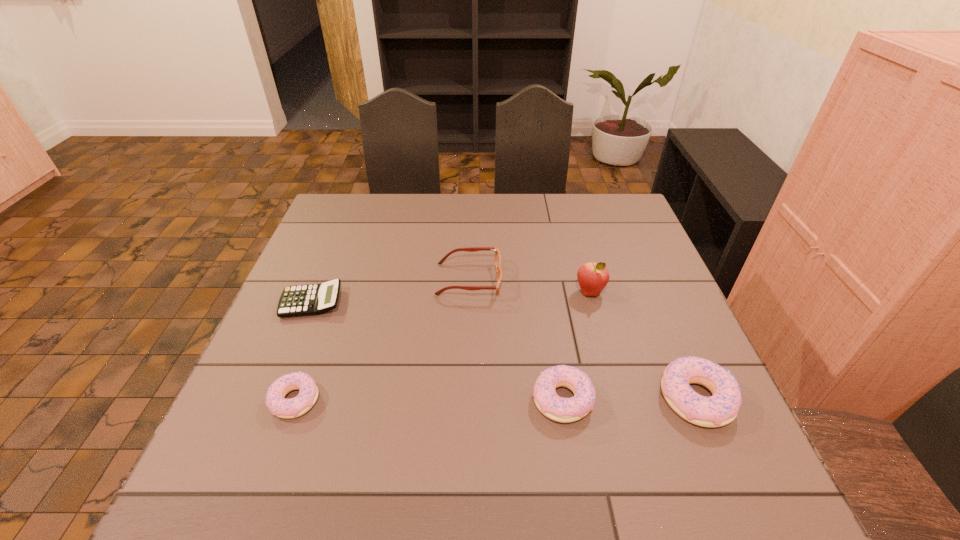
Identify the location of free spot that satisfies the following two spatial constraints: 1. on the back side of the leftmost doughnut; 2. on the left side of the tallest object. The height and width of the screenshot is (540, 960). (334, 292).

Find the location of `vacant space that satisfies the following two spatial constraints: 1. on the back side of the tallest object; 2. on the right side of the calculator`. vacant space that satisfies the following two spatial constraints: 1. on the back side of the tallest object; 2. on the right side of the calculator is located at coordinates (316, 292).

Where is `free spot that satisfies the following two spatial constraints: 1. on the front-facing side of the third object from left to right; 2. on the back side of the second tallest doughnut`? free spot that satisfies the following two spatial constraints: 1. on the front-facing side of the third object from left to right; 2. on the back side of the second tallest doughnut is located at coordinates click(x=466, y=399).

The image size is (960, 540). I want to click on vacant area that satisfies the following two spatial constraints: 1. on the front-facing side of the spectacles; 2. on the back side of the rightmost doughnut, so click(466, 399).

Where is `blank area in the image that satisfies the following two spatial constraints: 1. on the back side of the fourth object from left to right; 2. on the front-facing side of the spectacles`? This screenshot has width=960, height=540. blank area in the image that satisfies the following two spatial constraints: 1. on the back side of the fourth object from left to right; 2. on the front-facing side of the spectacles is located at coordinates (543, 279).

This screenshot has height=540, width=960. I want to click on free spot that satisfies the following two spatial constraints: 1. on the back side of the tallest object; 2. on the left side of the fifth tallest object, so click(334, 292).

At what (x,y) coordinates should I click in order to perform the action: click on free space in the image that satisfies the following two spatial constraints: 1. on the front-facing side of the spectacles; 2. on the back side of the rightmost object. Please return your answer as a coordinate pair (x, y). Image resolution: width=960 pixels, height=540 pixels. Looking at the image, I should click on (466, 399).